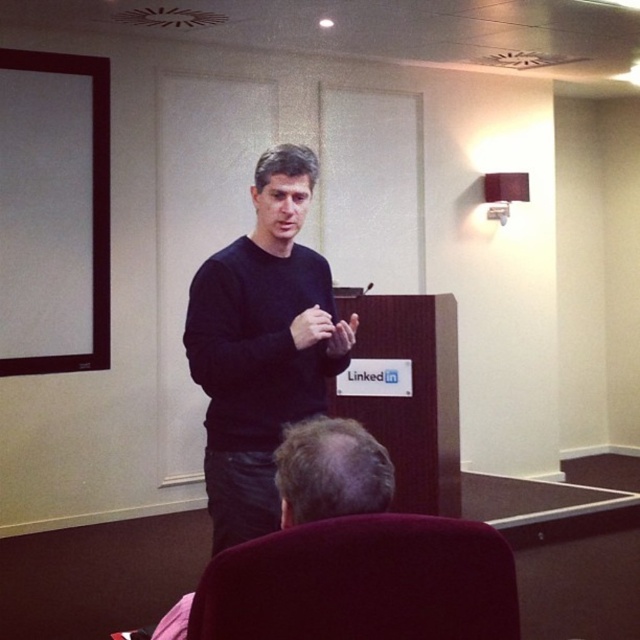
You are sitting in the velvet maroon chair at lower center and want to hand a document to the person wearing the black matte sweater at center. In which direction should you move to reach them?

The black matte sweater at center is to the left of the velvet maroon chair at lower center, so you should move to your left to reach them.

You are an assistant trying to locate the black matte sweater at center in the image. What are its coordinates?

The black matte sweater at center is located at coordinates (260, 346).

You are standing in the conference room and want to place a small plant on the podium so that it is exactly 2 meters away from where you are standing. Can you place it at the point labeled point (262,157)?

The point labeled point (262,157) is 2.22 meters from the viewer, which is slightly further than the desired 2 meters. Therefore, placing the plant there would make it 0.22 meters too far away.